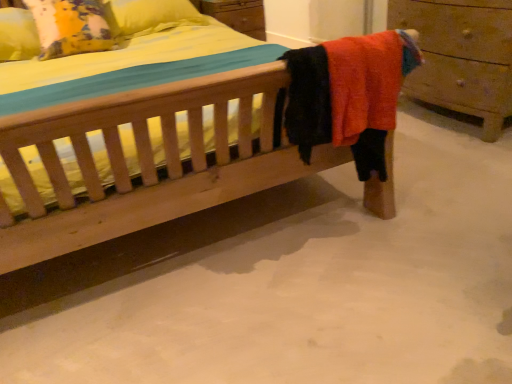
Question: From a real-world perspective, is yellow fabric pillow at upper left above or below wooden chest of drawers at right?

Choices:
 (A) below
 (B) above

Answer: (B)

Question: Based on their sizes in the image, would you say yellow fabric pillow at upper left is bigger or smaller than wooden chest of drawers at right?

Choices:
 (A) small
 (B) big

Answer: (A)

Question: Estimate the real-world distances between objects in this image. Which object is farther from the white smooth concrete at lower center?

Choices:
 (A) wooden chest of drawers at right
 (B) yellow fabric pillow at upper left

Answer: (B)

Question: Which of these objects is positioned farthest from the yellow fabric pillow at upper left?

Choices:
 (A) wooden chest of drawers at right
 (B) white smooth concrete at lower center

Answer: (A)